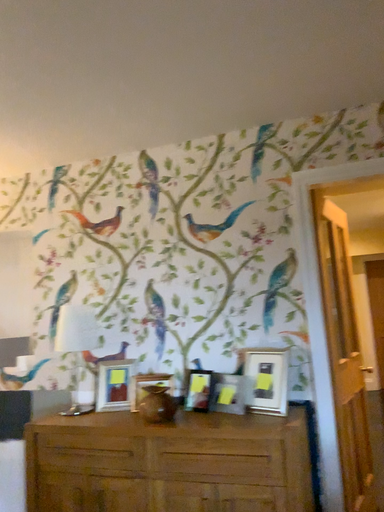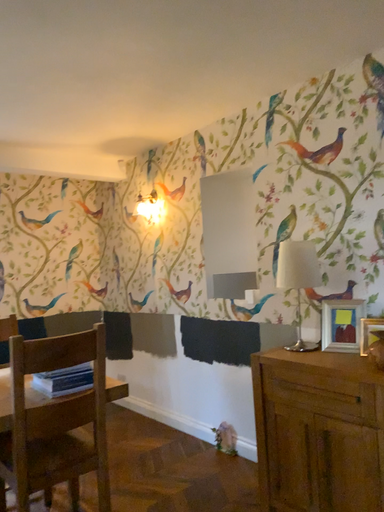
Question: How did the camera likely rotate when shooting the video?

Choices:
 (A) rotated left
 (B) rotated right

Answer: (A)